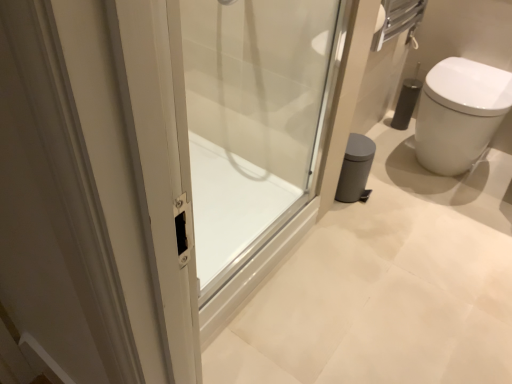
Describe the element at coordinates (459, 113) in the screenshot. I see `white glossy bidet at right` at that location.

You are a GUI agent. You are given a task and a screenshot of the screen. Output one action in this format:
    pyautogui.click(x=<x>, y=<y>)
    Task: Click on the white glossy bidet at right
    
    Given the screenshot: What is the action you would take?
    pyautogui.click(x=459, y=113)

The image size is (512, 384). Find the location of `white glossy bidet at right`. white glossy bidet at right is located at coordinates (459, 113).